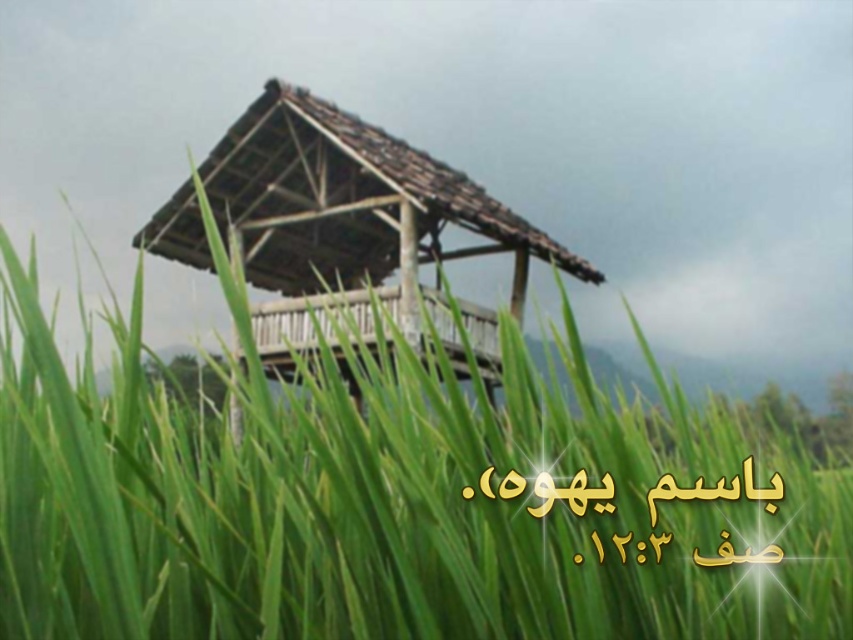
You are standing at the edge of a rice field and see the green grass at center and the wooden gazebo at center. Which one is closer to you?

The green grass at center is closer because it is only 13.39 meters away from the wooden gazebo at center, which is further away.

You are a landscape architect designing a garden. You have to place a small wooden bench between the green grass at center and the wooden gazebo at center. Which object should the bench be closer to if you want it to be proportionally balanced with the sizes of both objects?

The bench should be closer to the wooden gazebo at center because the green grass at center is bigger, so placing the bench closer to the smaller wooden gazebo at center will create a balanced proportion between the two objects.

Imagine you are standing in the rural scene and want to walk towards the wooden gazebo at center. Which direction should you move relative to the green grass at center?

Since the green grass at center is closer to the viewer than the wooden gazebo at center, you should move away from the green grass at center to reach the wooden gazebo at center.